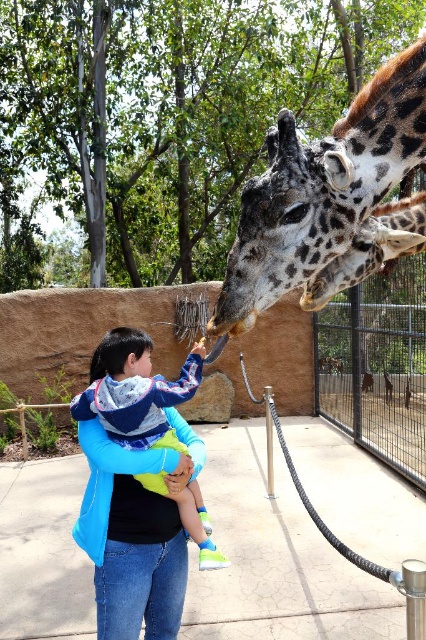
You are a zookeeper who needs to feed the spotted fur giraffe at upper center. You have a 1.5 meter long feeding stick. Can you reach the giraffe from your current position?

The spotted fur giraffe at upper center is 1.67 meters from camera, so the feeding stick which is 1.5 meters long is not long enough to reach the giraffe.

You are a zookeeper who needs to feed the giraffes. You have two feeding stations available. One is placed near the spotted fur giraffe at upper center and the other near the spotted fur giraffe at center. Which feeding station should you choose to feed the larger giraffe?

The spotted fur giraffe at upper center is larger in size than the spotted fur giraffe at center, so you should choose the feeding station near the spotted fur giraffe at upper center to feed the larger giraffe.

You are standing at the zoo and see two points marked in the image. The first point is at coordinate point [284,129] and the second point is at coordinate point [368,396]. Which point is closer to you?

Point [284,129] is in front of point [368,396], so it is closer to you.